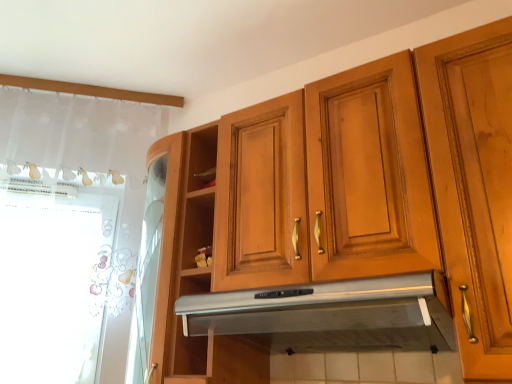
Question: Is point (162, 246) closer or farther from the camera than point (10, 345)?

Choices:
 (A) closer
 (B) farther

Answer: (A)

Question: Considering the relative positions of wooden cabinet at upper center and white lace curtain at left in the image provided, is wooden cabinet at upper center to the left or to the right of white lace curtain at left?

Choices:
 (A) left
 (B) right

Answer: (B)

Question: Which object is positioned farthest from the wooden cabinet at upper center?

Choices:
 (A) silver metallic exhaust hood at center
 (B) white lace curtain at left

Answer: (B)

Question: Estimate the real-world distances between objects in this image. Which object is closer to the white lace curtain at left?

Choices:
 (A) wooden cabinet at upper center
 (B) silver metallic exhaust hood at center

Answer: (A)